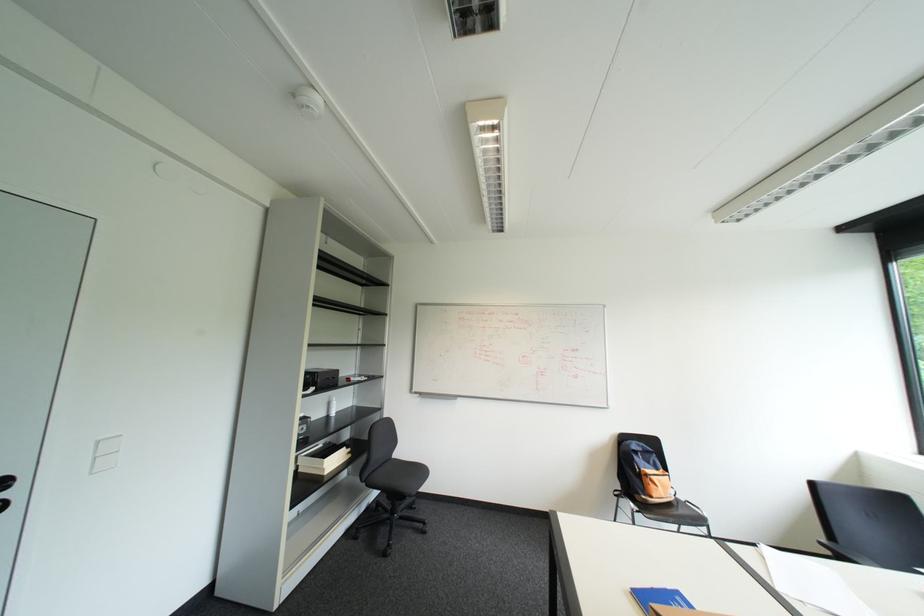
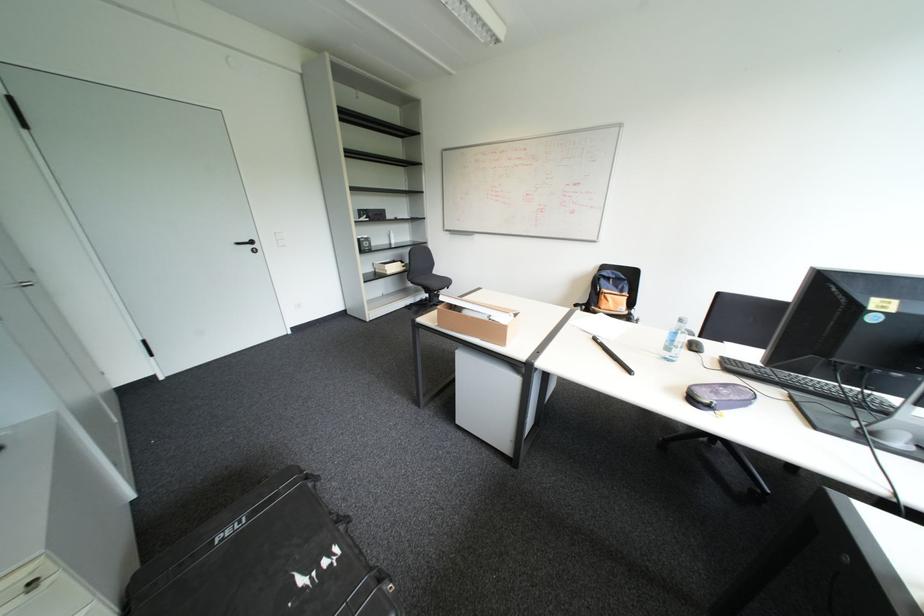
In the second image, find the point that corresponds to (x=395, y=460) in the first image.

(434, 273)